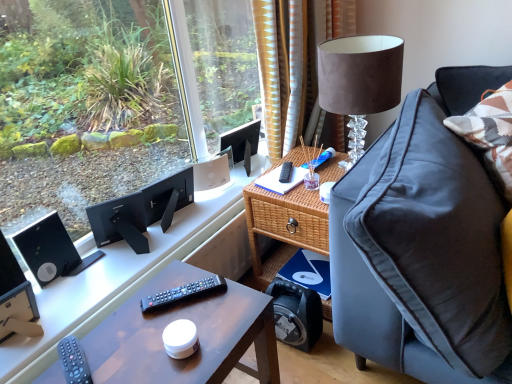
Find the location of `blank space to the left of black plastic remote at center, the second remote control in the top-to-bottom sequence`. blank space to the left of black plastic remote at center, the second remote control in the top-to-bottom sequence is located at coordinates (130, 314).